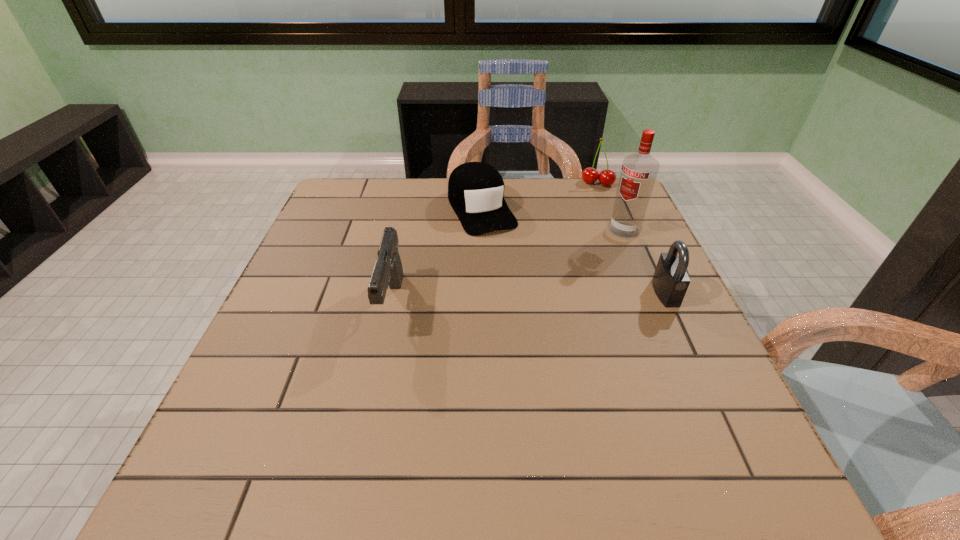
In order to click on free space on the desktop that is between the pistol and the padlock and is positioned on the front label of the vodka in this screenshot , I will do `click(541, 298)`.

The image size is (960, 540). Find the location of `vacant space on the desktop that is between the pistol and the padlock and is positioned with the stems of the cherry pointing upwards`. vacant space on the desktop that is between the pistol and the padlock and is positioned with the stems of the cherry pointing upwards is located at coordinates (569, 297).

Identify the location of free spot on the desktop that is between the pistol and the padlock and is positioned on the front-facing side of the second object from left to right. The height and width of the screenshot is (540, 960). (535, 298).